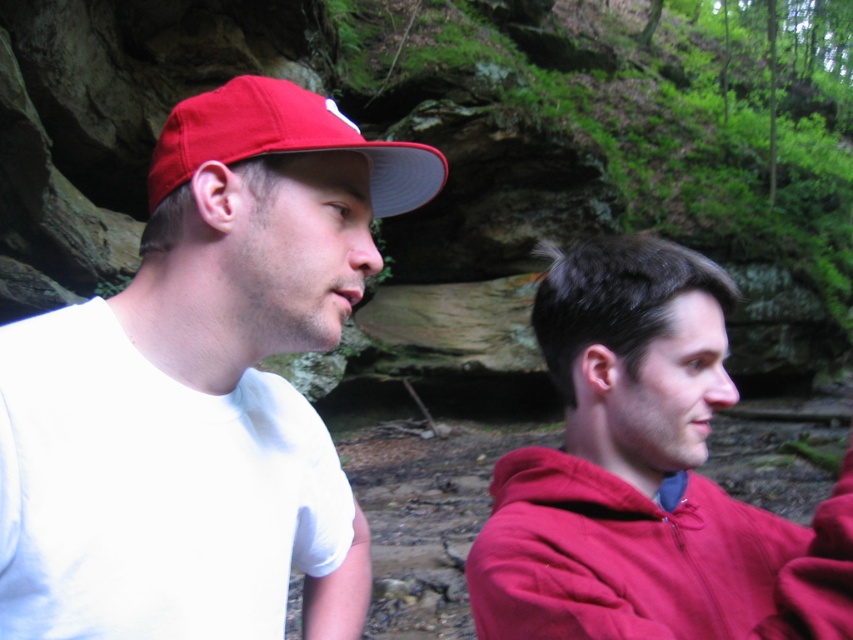
Is matte red hoodie at right positioned before matte red sweatshirt at right?

No, matte red hoodie at right is further to the viewer.

Can you confirm if matte red hoodie at right is positioned below matte red sweatshirt at right?

Incorrect, matte red hoodie at right is not positioned below matte red sweatshirt at right.

This screenshot has height=640, width=853. What do you see at coordinates (645, 476) in the screenshot? I see `matte red hoodie at right` at bounding box center [645, 476].

The height and width of the screenshot is (640, 853). What are the coordinates of `matte red hoodie at right` in the screenshot? It's located at (645, 476).

Which is more to the left, white matte t-shirt at left or matte red baseball cap at left?

Positioned to the left is white matte t-shirt at left.

Which is in front, point (178, 396) or point (343, 145)?

Point (343, 145)

Is point (294, 406) positioned behind point (294, 96)?

Yes, it is.

Find the location of a particular element. Image resolution: width=853 pixels, height=640 pixels. white matte t-shirt at left is located at coordinates (201, 388).

From the picture: Can you confirm if white matte t-shirt at left is smaller than matte red sweatshirt at right?

No, white matte t-shirt at left is not smaller than matte red sweatshirt at right.

Measure the distance from white matte t-shirt at left to matte red sweatshirt at right.

white matte t-shirt at left and matte red sweatshirt at right are 9.53 inches apart.

Is point (267, 99) positioned behind point (747, 595)?

No, it is in front of (747, 595).

Where is `white matte t-shirt at left`? white matte t-shirt at left is located at coordinates (201, 388).